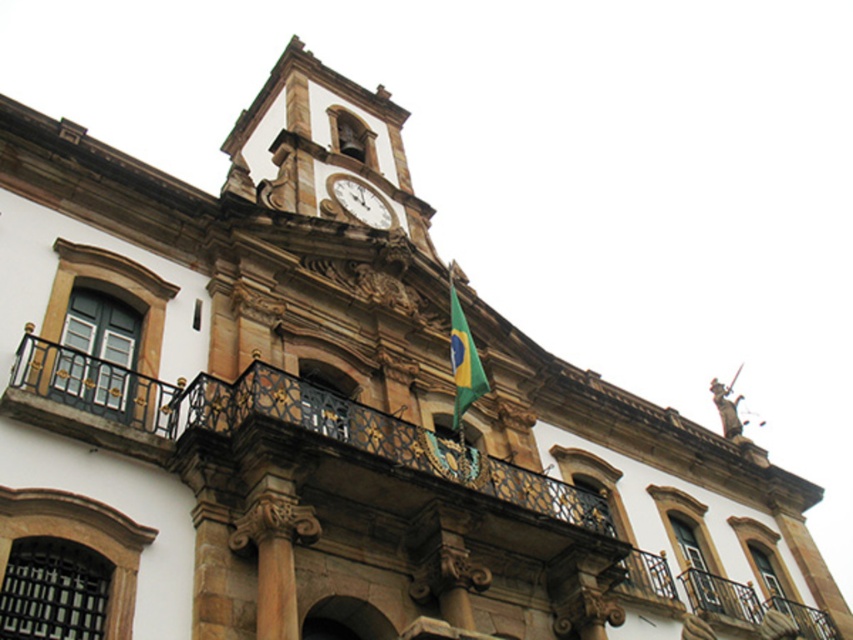
Question: Observing the image, what is the correct spatial positioning of green fabric flag at center in reference to white marble clock at upper center?

Choices:
 (A) right
 (B) left

Answer: (A)

Question: Does green fabric flag at center appear on the left side of white marble clock at upper center?

Choices:
 (A) no
 (B) yes

Answer: (A)

Question: Can you confirm if green fabric flag at center is positioned to the left of white marble clock at upper center?

Choices:
 (A) no
 (B) yes

Answer: (A)

Question: Among these objects, which one is nearest to the camera?

Choices:
 (A) white marble clock at upper center
 (B) green fabric flag at center

Answer: (B)